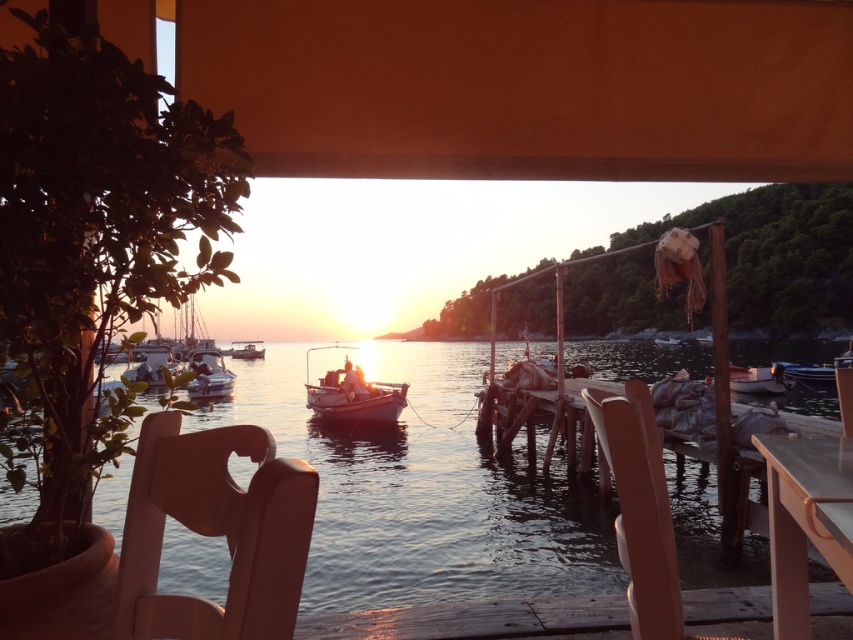
Is point (706, 93) farther from camera compared to point (770, 376)?

That is False.

Image resolution: width=853 pixels, height=640 pixels. What do you see at coordinates (527, 86) in the screenshot? I see `orange fabric canopy at upper center` at bounding box center [527, 86].

Identify the location of orange fabric canopy at upper center. The height and width of the screenshot is (640, 853). (527, 86).

Can you confirm if wooden boat at center is smaller than white plastic boat at right?

Yes, wooden boat at center is smaller than white plastic boat at right.

Is wooden boat at center wider than white plastic boat at right?

Incorrect, wooden boat at center's width does not surpass white plastic boat at right's.

The width and height of the screenshot is (853, 640). What are the coordinates of `wooden boat at center` in the screenshot? It's located at (354, 394).

Based on the photo, is matte plastic chair at lower left thinner than matte plastic chair at lower right?

Yes.

Is point (230, 529) behind point (650, 490)?

No, (230, 529) is closer to viewer.

Identify the location of matte plastic chair at lower left. The height and width of the screenshot is (640, 853). (213, 531).